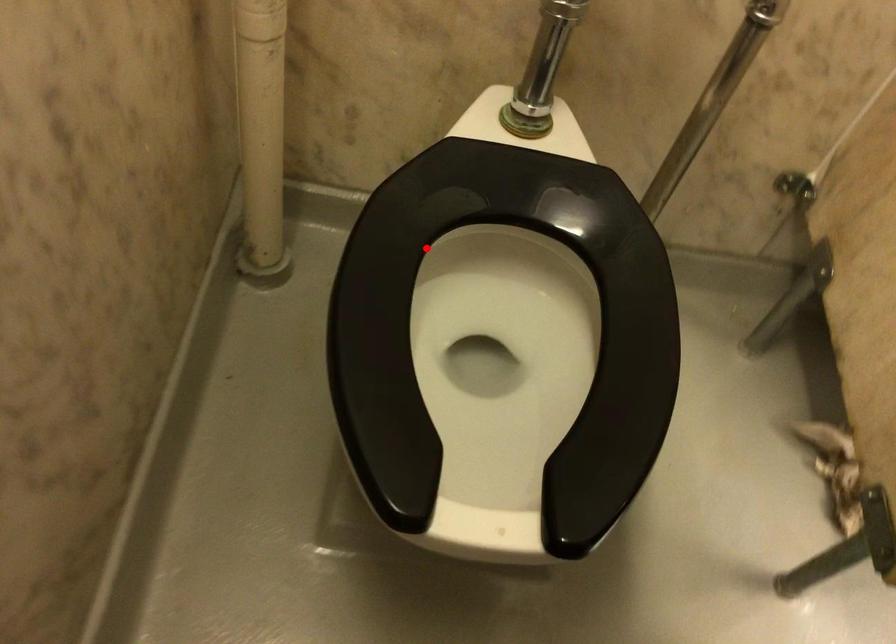
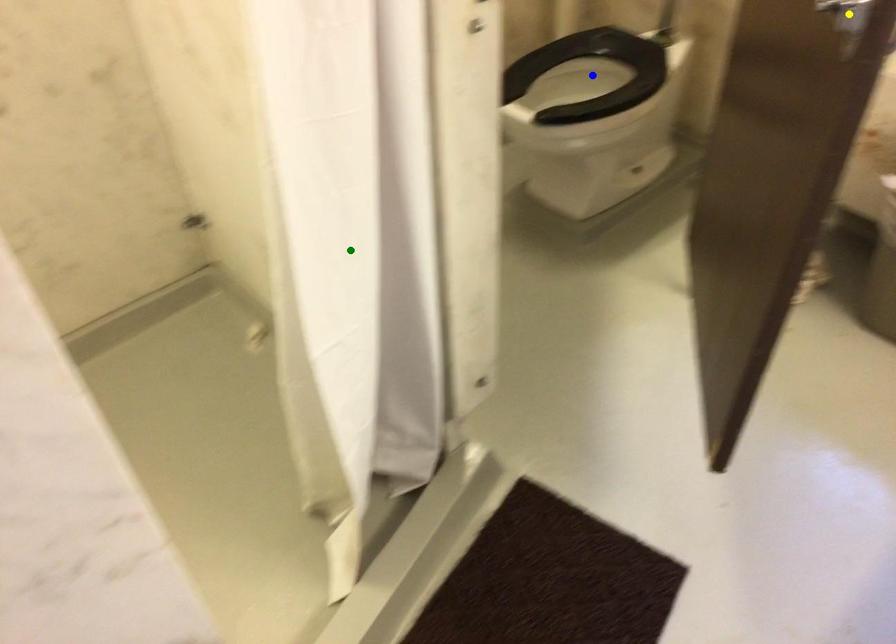
Question: I am providing you with two images of the same scene from different viewpoints. A red point is marked on the first image. You are given multiple points on the second image. Can you choose the point in image 2 that corresponds to the point in image 1?

Choices:
 (A) yellow point
 (B) green point
 (C) blue point

Answer: (C)